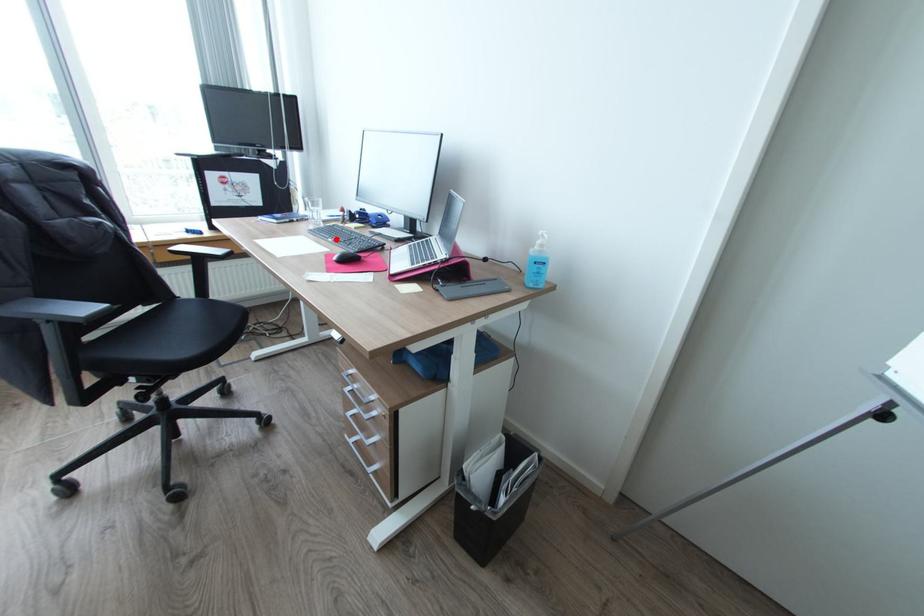
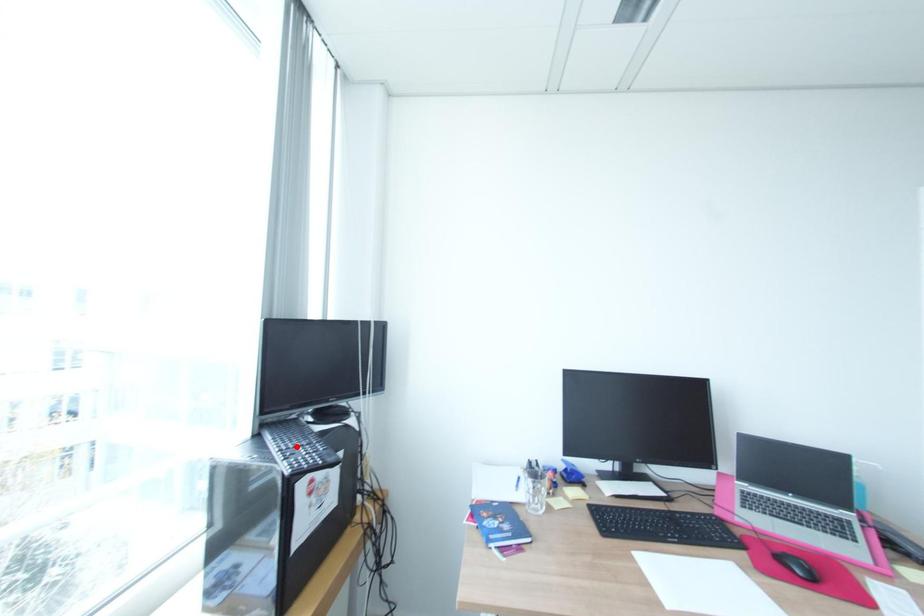
I am providing you with two images of the same scene from different viewpoints. A red point is marked on the first image and another point is marked on the second image. Is the marked point in image1 the same physical position as the marked point in image2?

No